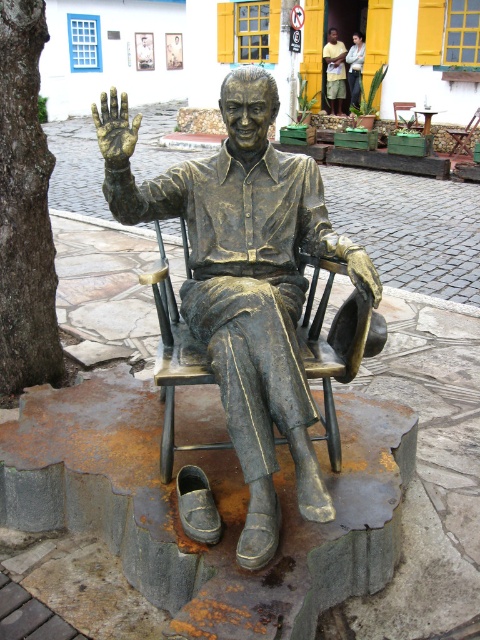
Question: Which of the following is the farthest from the observer?

Choices:
 (A) bronze textured rocking chair at center
 (B) gold metallic hand at center
 (C) bronze statue at center
 (D) light brown wood statue at center

Answer: (D)

Question: Does bronze textured rocking chair at center lie behind light brown wood statue at center?

Choices:
 (A) no
 (B) yes

Answer: (A)

Question: Considering the relative positions of bronze statue at center and gold metallic hand at center in the image provided, where is bronze statue at center located with respect to gold metallic hand at center?

Choices:
 (A) below
 (B) above

Answer: (A)

Question: Is bronze textured rocking chair at center closer to camera compared to gold metallic hand at center?

Choices:
 (A) no
 (B) yes

Answer: (A)

Question: Which object appears closest to the camera in this image?

Choices:
 (A) bronze statue at center
 (B) gold metallic hand at center

Answer: (A)

Question: Which object is positioned closest to the bronze statue at center?

Choices:
 (A) gold metallic hand at center
 (B) light brown wood statue at center

Answer: (A)